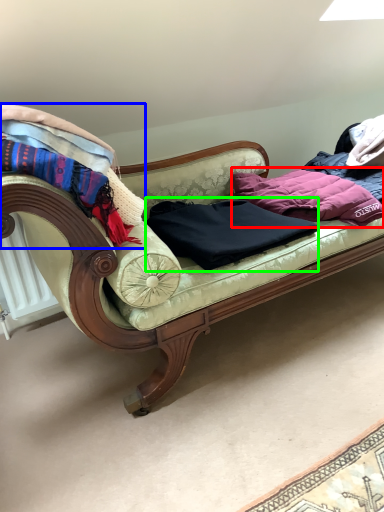
Question: Considering the real-world distances, which object is closest to clothing (highlighted by a red box)? blanket (highlighted by a blue box) or clothing (highlighted by a green box).

Choices:
 (A) blanket
 (B) clothing

Answer: (B)